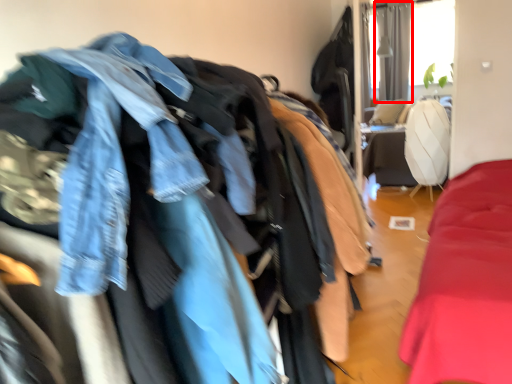
Question: From the image's perspective, where is curtain (annotated by the red box) located relative to jacket?

Choices:
 (A) above
 (B) below

Answer: (A)